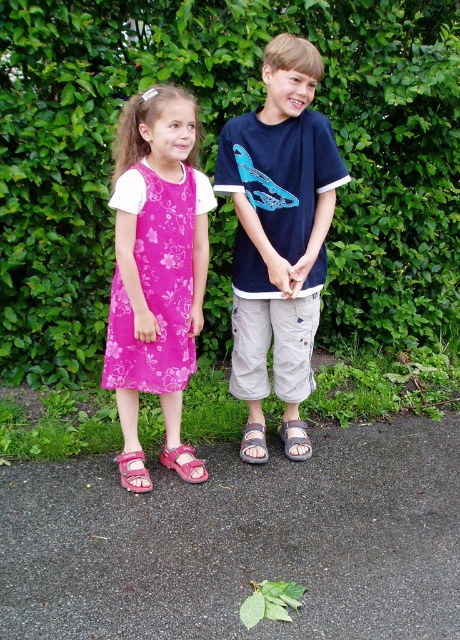
Which is more to the left, navy blue t-shirt at center or pink fabric sandal at lower center?

Positioned to the left is pink fabric sandal at lower center.

Does navy blue t-shirt at center appear under pink fabric sandal at lower center?

No, navy blue t-shirt at center is not below pink fabric sandal at lower center.

Find the location of a particular element. The image size is (460, 640). navy blue t-shirt at center is located at coordinates (279, 225).

Does pink fabric sandal at lower center appear over pink fabric sandal at lower left?

Correct, pink fabric sandal at lower center is located above pink fabric sandal at lower left.

Who is positioned more to the left, pink fabric sandal at lower center or pink fabric sandal at lower left?

pink fabric sandal at lower left

Between point (190, 481) and point (130, 458), which one is positioned in front?

Point (130, 458)

The image size is (460, 640). In order to click on pink fabric sandal at lower center in this screenshot , I will do `click(184, 464)`.

Can you confirm if pink floral dress at left is positioned to the left of pink fabric sandal at lower left?

Incorrect, pink floral dress at left is not on the left side of pink fabric sandal at lower left.

Between point (124, 316) and point (138, 472), which one is positioned in front?

Point (124, 316)

Identify the location of pink floral dress at left. This screenshot has height=640, width=460. (155, 257).